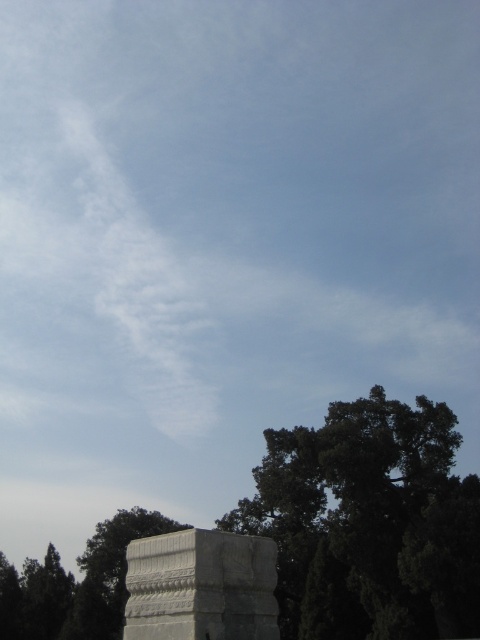
Question: Which of the following is the closest to the observer?

Choices:
 (A) green leafy tree at lower left
 (B) green leafy tree at lower right
 (C) white stone monument at lower center

Answer: (C)

Question: Can you confirm if white stone monument at lower center is positioned to the left of green leafy tree at lower left?

Choices:
 (A) no
 (B) yes

Answer: (A)

Question: Considering the real-world distances, which object is farthest from the green leafy tree at lower left?

Choices:
 (A) green leafy tree at lower right
 (B) white stone monument at lower center

Answer: (B)

Question: Among these points, which one is farthest from the camera?

Choices:
 (A) (307, 488)
 (B) (275, 627)

Answer: (A)

Question: Can you confirm if green leafy tree at lower right is positioned to the left of green leafy tree at lower left?

Choices:
 (A) no
 (B) yes

Answer: (A)

Question: Can you confirm if white stone monument at lower center is positioned below green leafy tree at lower left?

Choices:
 (A) yes
 (B) no

Answer: (B)